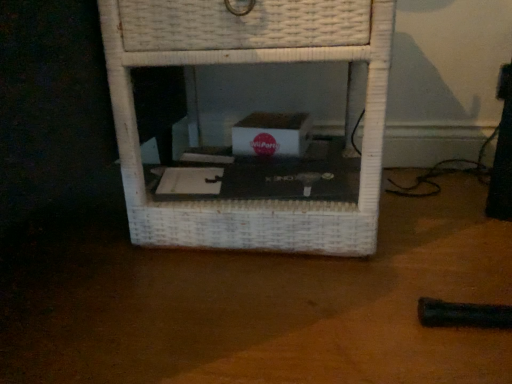
You are a GUI agent. You are given a task and a screenshot of the screen. Output one action in this format:
    pyautogui.click(x=<x>, y=<y>)
    Task: Click on the black matte table at center
    Image resolution: width=512 pixels, height=384 pixels.
    Given the screenshot: What is the action you would take?
    pyautogui.click(x=263, y=305)

In order to face black matte table at center, should I rotate leftwards or rightwards?

It's best to rotate left around 11.199 degrees.

This screenshot has height=384, width=512. Describe the element at coordinates (263, 305) in the screenshot. I see `black matte table at center` at that location.

This screenshot has height=384, width=512. Describe the element at coordinates (249, 63) in the screenshot. I see `white wicker shelf at center` at that location.

The height and width of the screenshot is (384, 512). Find the location of `white wicker shelf at center`. white wicker shelf at center is located at coordinates (249, 63).

I want to click on black matte table at center, so click(x=263, y=305).

Can you confirm if white wicker shelf at center is positioned to the left of black matte table at center?

In fact, white wicker shelf at center is to the right of black matte table at center.

Does white wicker shelf at center come in front of black matte table at center?

No, white wicker shelf at center is behind black matte table at center.

Which is closer to the camera, (310, 239) or (295, 329)?

The point (295, 329) is closer to the camera.

From the image's perspective, is white wicker shelf at center positioned above or below black matte table at center?

Based on their image positions, white wicker shelf at center is located above black matte table at center.

From a real-world perspective, which object stands above the other?

white wicker shelf at center.

Considering the sizes of objects white wicker shelf at center and black matte table at center in the image provided, who is thinner, white wicker shelf at center or black matte table at center?

With smaller width is white wicker shelf at center.

Considering the relative sizes of white wicker shelf at center and black matte table at center in the image provided, is white wicker shelf at center shorter than black matte table at center?

Incorrect, the height of white wicker shelf at center does not fall short of that of black matte table at center.

Considering the relative sizes of white wicker shelf at center and black matte table at center in the image provided, is white wicker shelf at center bigger than black matte table at center?

Indeed, white wicker shelf at center has a larger size compared to black matte table at center.

Is white wicker shelf at center not inside black matte table at center?

Yes, white wicker shelf at center is located beyond the bounds of black matte table at center.

Would you consider white wicker shelf at center to be distant from black matte table at center?

white wicker shelf at center is near black matte table at center, not far away.

Is white wicker shelf at center oriented away from black matte table at center?

white wicker shelf at center is not turned away from black matte table at center.

How much distance is there between white wicker shelf at center and black matte table at center?

white wicker shelf at center and black matte table at center are 6.73 inches apart.

Where is `table top on the left of the white wicker shelf at center`? This screenshot has width=512, height=384. table top on the left of the white wicker shelf at center is located at coordinates (263, 305).

Is black matte table at center at the left side of white wicker shelf at center?

Yes.

Is black matte table at center further to camera compared to white wicker shelf at center?

No, black matte table at center is in front of white wicker shelf at center.

Is point (318, 382) closer or farther from the camera than point (186, 15)?

Point (318, 382) appears to be closer to the viewer than point (186, 15).

Looking at this image, from the image's perspective, does black matte table at center appear lower than white wicker shelf at center?

Yes.

From a real-world perspective, which is physically below, black matte table at center or white wicker shelf at center?

black matte table at center, from a real-world perspective.

Does black matte table at center have a lesser width compared to white wicker shelf at center?

No, black matte table at center is not thinner than white wicker shelf at center.

Considering the sizes of objects black matte table at center and white wicker shelf at center in the image provided, who is shorter, black matte table at center or white wicker shelf at center?

Standing shorter between the two is black matte table at center.

Does black matte table at center have a smaller size compared to white wicker shelf at center?

Yes, black matte table at center is smaller than white wicker shelf at center.

Does black matte table at center contain white wicker shelf at center?

No, white wicker shelf at center is located outside of black matte table at center.

Is black matte table at center placed right next to white wicker shelf at center?

They are not placed beside each other.

Is black matte table at center oriented towards white wicker shelf at center?

No, black matte table at center is not turned towards white wicker shelf at center.

How many degrees apart are the facing directions of black matte table at center and white wicker shelf at center?

0.566 degrees.

This screenshot has width=512, height=384. In order to click on table top in front of the white wicker shelf at center in this screenshot , I will do `click(263, 305)`.

Find the location of a particular element. This screenshot has height=384, width=512. table top below the white wicker shelf at center (from a real-world perspective) is located at coordinates (263, 305).

Identify the location of furniture located on the right of black matte table at center. (249, 63).